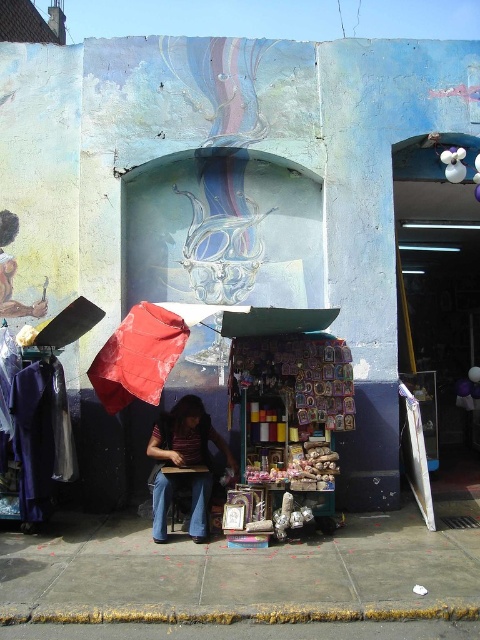
Question: Among these objects, which one is farthest from the camera?

Choices:
 (A) matte red umbrella at center
 (B) concrete curb at lower center
 (C) striped fabric umbrella at center

Answer: (C)

Question: Which object is farther from the camera taking this photo?

Choices:
 (A) concrete curb at lower center
 (B) matte red umbrella at center

Answer: (B)

Question: Is concrete sidewalk at center positioned in front of concrete curb at lower center?

Choices:
 (A) yes
 (B) no

Answer: (B)

Question: Does concrete sidewalk at center appear under striped fabric umbrella at center?

Choices:
 (A) no
 (B) yes

Answer: (B)

Question: Which of these objects is positioned closest to the concrete sidewalk at center?

Choices:
 (A) matte red umbrella at center
 (B) concrete curb at lower center

Answer: (B)

Question: Can you confirm if concrete curb at lower center is bigger than matte red umbrella at center?

Choices:
 (A) no
 (B) yes

Answer: (A)